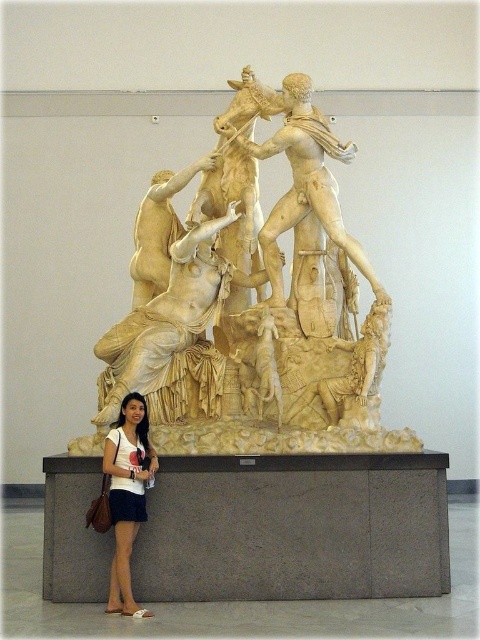
You are standing in a museum and want to take a photo of the white marble sculpture at center. The museum has a strict rule that you must stand exactly at point 0.481, 0.533 to take the photo. Can you confirm if this point is the correct location for capturing the sculpture?

Yes, the white marble sculpture at center is located exactly at point (255,307), so standing there will allow you to capture it correctly.

You are an art curator planning to install a new exhibit. You have a white marble sculpture at center and a matte white dress at lower left. Given their sizes, which object will require more vertical space for proper display?

The white marble sculpture at center requires more vertical space because it has a greater height compared to the matte white dress at lower left.